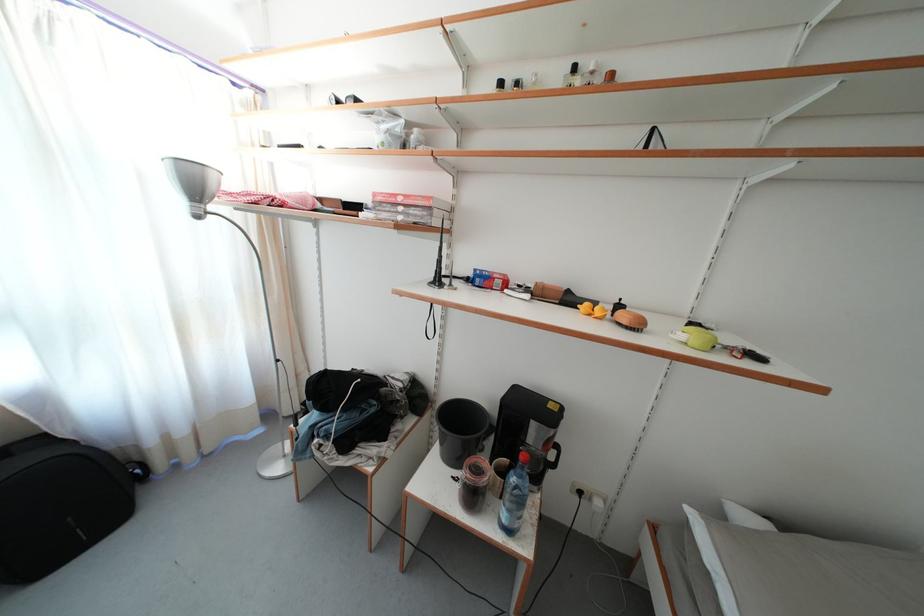
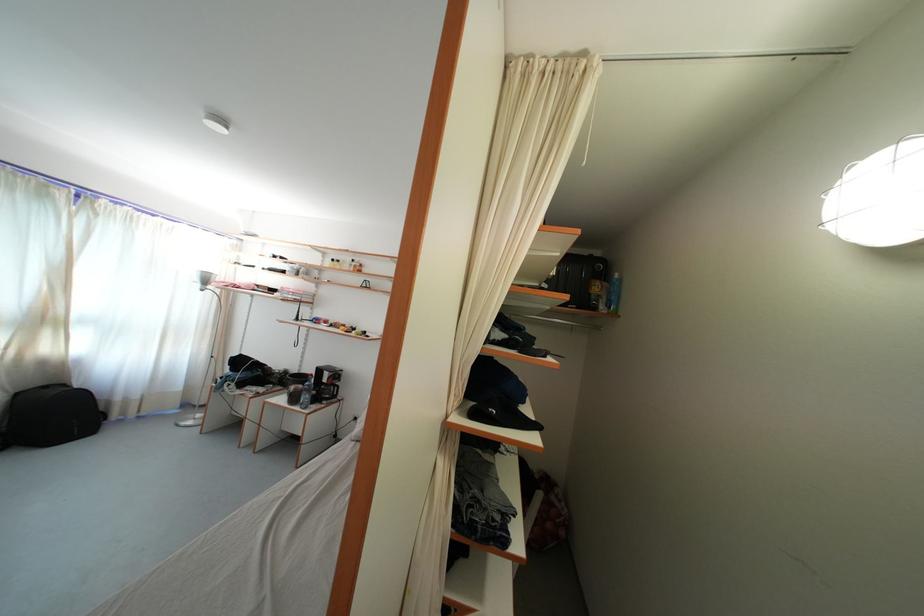
In the second image, find the point that corresponds to the point at 188,438 in the first image.

(141, 403)